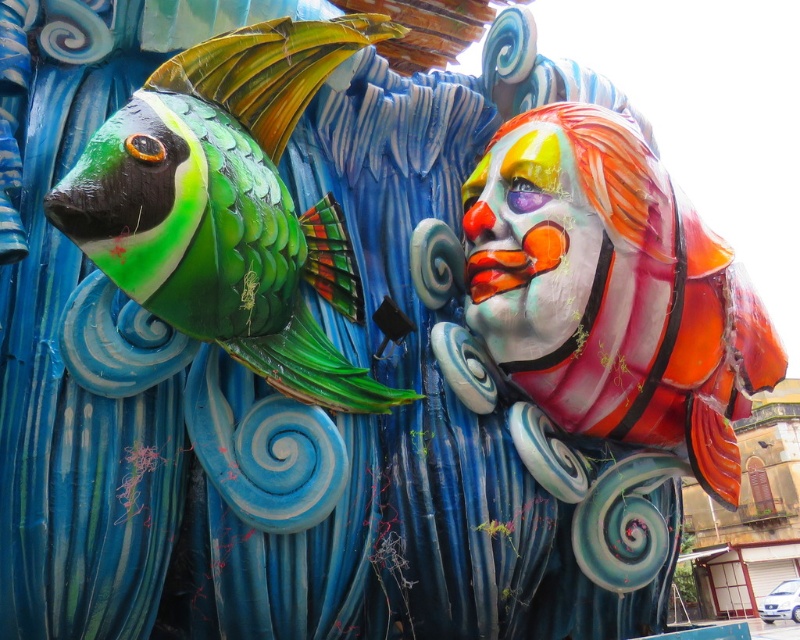
You are an art curator planning to display both the shiny orange fish at right and the matte painted clown head at right in a gallery. Considering their sizes, which sculpture should be placed higher on the wall to ensure they appear balanced visually?

The shiny orange fish at right is bigger than the matte painted clown head at right, so placing the larger shiny orange fish at right higher on the wall would help balance the composition by compensating for its size with a higher position.

You are an artist standing between the two sculptures, the matte painted clown head at right and the matte clown face at right. You want to place a 40 cm wide decorative panel between them. Will there be enough space?

The distance between the matte painted clown head at right and the matte clown face at right is 42.24 centimeters. Since the decorative panel is 40 cm wide, there is enough space to place it between them with 2.24 centimeters to spare.

Based on the photo, you are standing in front of the image and want to determine which of the two points, point (274, 44) or point (536, 308), is nearer to you. Based on the scene description, which point is closer?

Point (274, 44) is closer to the camera than point (536, 308), so it is the nearer point.